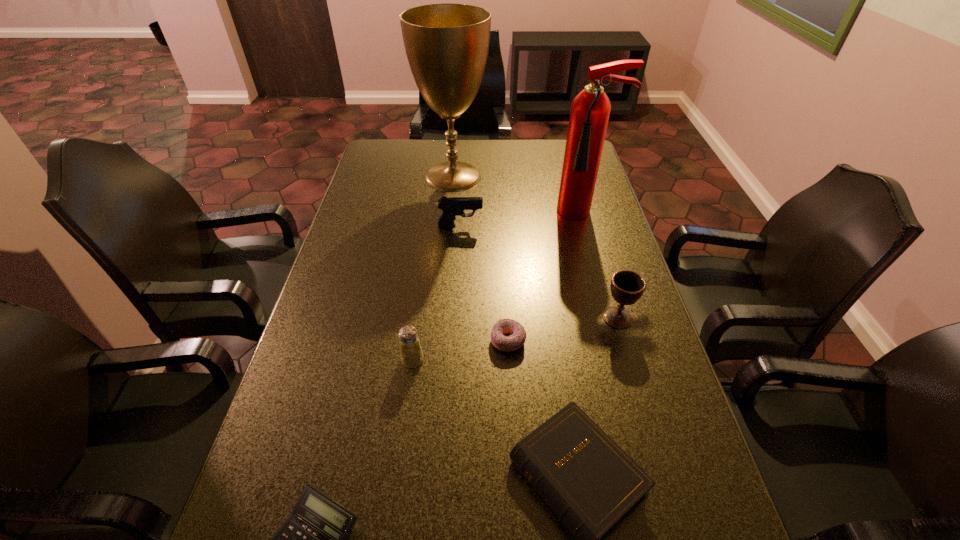
Identify the location of vacant area between the fire extinguisher and the trophy cup. The image size is (960, 540). (519, 195).

Where is `vacant point located between the pistol and the saltshaker`? The image size is (960, 540). vacant point located between the pistol and the saltshaker is located at coordinates (436, 293).

Locate which object ranks fourth in proximity to the third shortest object. Please provide its 2D coordinates. Your answer should be formatted as a tuple, i.e. [(x, y)], where the tuple contains the x and y coordinates of a point satisfying the conditions above.

[(313, 539)]

Find the location of a particular element. Image resolution: width=960 pixels, height=540 pixels. the third closest object relative to the fire extinguisher is located at coordinates (627, 287).

I want to click on free space that satisfies the following two spatial constraints: 1. on the front side of the trophy cup; 2. on the left side of the chalice, so click(442, 318).

The height and width of the screenshot is (540, 960). Find the location of `vacant region that satisfies the following two spatial constraints: 1. at the barrel of the pistol; 2. on the back side of the second shortest object`. vacant region that satisfies the following two spatial constraints: 1. at the barrel of the pistol; 2. on the back side of the second shortest object is located at coordinates (454, 341).

You are a GUI agent. You are given a task and a screenshot of the screen. Output one action in this format:
    pyautogui.click(x=<x>, y=<y>)
    Task: Click on the vacant area in the image that satisfies the following two spatial constraints: 1. at the nozzle of the fire extinguisher; 2. at the barrel of the pistol
    This screenshot has width=960, height=540.
    Given the screenshot: What is the action you would take?
    pyautogui.click(x=588, y=226)

Image resolution: width=960 pixels, height=540 pixels. In order to click on vacant space that satisfies the following two spatial constraints: 1. at the nozzle of the fire extinguisher; 2. on the right side of the chalice in this screenshot , I will do `click(614, 318)`.

Where is `free location that satisfies the following two spatial constraints: 1. at the barrel of the pistol; 2. on the back side of the chalice`? free location that satisfies the following two spatial constraints: 1. at the barrel of the pistol; 2. on the back side of the chalice is located at coordinates (455, 318).